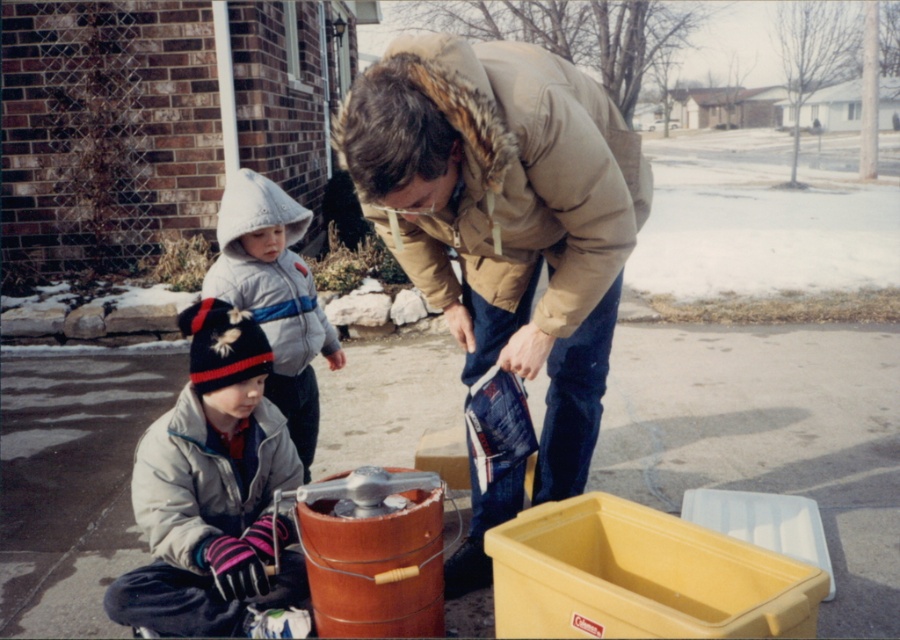
You are standing at the origin point of the coordinate system in the winter scene. You need to locate the white fleece jacket at lower left. What are its coordinates?

The white fleece jacket at lower left is located at coordinates point (212, 490).